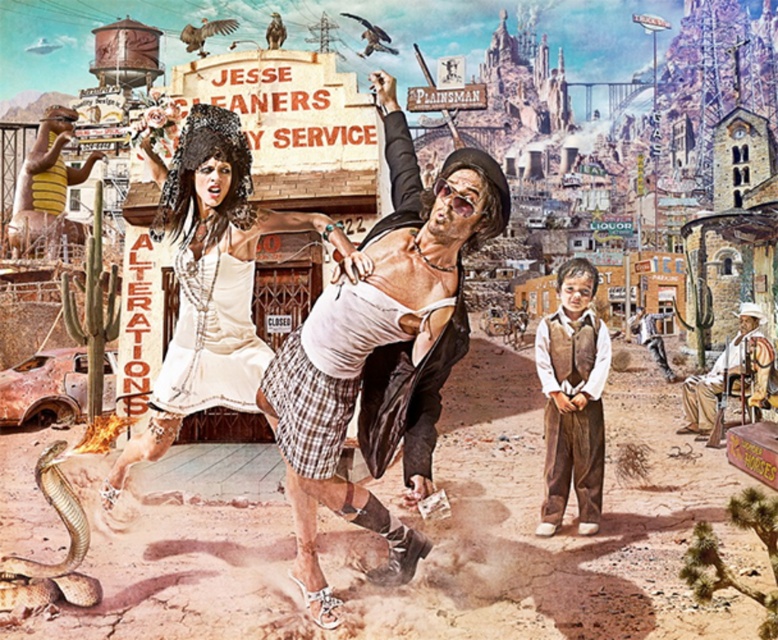
What is the object located at coordinates point [212,280] in the image?

The point [212,280] corresponds to the white lace dress at center.

You are a photographer trying to capture the white lace dress at center and the brown cotton vest at lower right in a single shot. Which object will appear larger in the photo?

The white lace dress at center appears larger because it is positioned over the brown cotton vest at lower right, indicating it is closer to the camera.